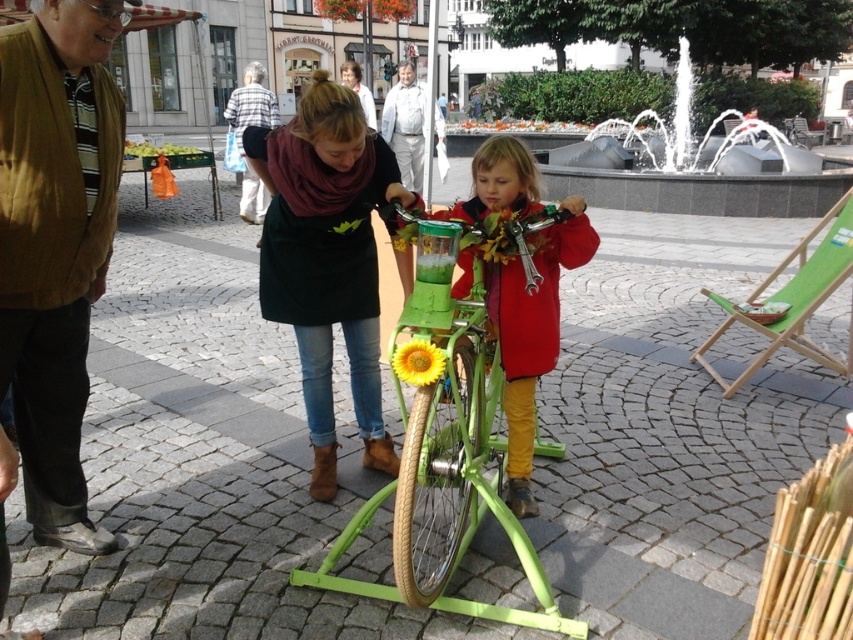
You are a delivery person who needs to carry a large package. You see a brown woolen jacket at left and a green matte bicycle at center. Which object can you use to carry the package?

The brown woolen jacket at left is larger in size than the green matte bicycle at center, so the brown woolen jacket at left can be used to carry the package.

You are standing at the point with coordinates point (403, 536) and want to walk towards the fountain in the background. Is the point (9, 316) in your path?

Yes, the point (9, 316) is behind point (403, 536), so it is along the path towards the fountain.

You are a pedestrian looking at the brown woolen jacket at left and the green matte bicycle at center. Which object is positioned higher in the image?

The brown woolen jacket at left is above the green matte bicycle at center in the image.